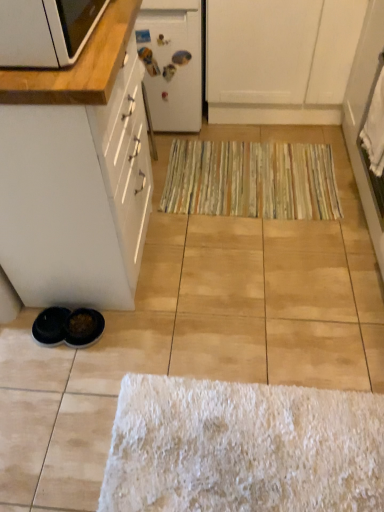
Question: Is white matte cabinet at lower left, the 1th cabinetry when ordered from front to back, not near white matte refrigerator at upper center?

Choices:
 (A) yes
 (B) no

Answer: (B)

Question: Considering the relative sizes of white matte cabinet at lower left, the second cabinetry from the back, and white matte refrigerator at upper center in the image provided, is white matte cabinet at lower left, the second cabinetry from the back, bigger than white matte refrigerator at upper center?

Choices:
 (A) no
 (B) yes

Answer: (B)

Question: Could you tell me if white matte cabinet at lower left, the second cabinetry from the back, is facing white matte refrigerator at upper center?

Choices:
 (A) yes
 (B) no

Answer: (B)

Question: Can we say white matte cabinet at lower left, placed as the 2th cabinetry when sorted from top to bottom, lies outside white matte refrigerator at upper center?

Choices:
 (A) no
 (B) yes

Answer: (B)

Question: Is white matte cabinet at lower left, which is the first cabinetry from bottom to top, surrounding white matte refrigerator at upper center?

Choices:
 (A) yes
 (B) no

Answer: (B)

Question: In terms of height, does matte wood countertop at upper left look taller or shorter compared to white matte cabinet at upper center, acting as the 2th cabinetry starting from the bottom?

Choices:
 (A) short
 (B) tall

Answer: (A)

Question: Is matte wood countertop at upper left in front of or behind white matte cabinet at upper center, arranged as the second cabinetry when viewed from the left, in the image?

Choices:
 (A) front
 (B) behind

Answer: (A)

Question: Is point (122, 26) positioned closer to the camera than point (339, 36)?

Choices:
 (A) closer
 (B) farther

Answer: (A)

Question: Looking at their shapes, would you say matte wood countertop at upper left is wider or thinner than white matte cabinet at upper center, acting as the 2th cabinetry starting from the bottom?

Choices:
 (A) thin
 (B) wide

Answer: (A)

Question: From their relative heights in the image, would you say white matte refrigerator at upper center is taller or shorter than white matte cabinet at lower left, the 1th cabinetry when ordered from front to back?

Choices:
 (A) tall
 (B) short

Answer: (B)

Question: From the image's perspective, is white matte refrigerator at upper center above or below white matte cabinet at lower left, the 1th cabinetry when ordered from front to back?

Choices:
 (A) below
 (B) above

Answer: (B)

Question: Is point tap(195, 15) closer or farther from the camera than point tap(1, 146)?

Choices:
 (A) closer
 (B) farther

Answer: (B)

Question: From a real-world perspective, relative to white matte cabinet at lower left, the 1th cabinetry when ordered from front to back, is white matte refrigerator at upper center vertically above or below?

Choices:
 (A) above
 (B) below

Answer: (B)

Question: From a real-world perspective, is matte wood countertop at upper left above or below white matte cabinet at lower left, which is counted as the 2th cabinetry, starting from the right?

Choices:
 (A) above
 (B) below

Answer: (A)

Question: Based on their sizes in the image, would you say matte wood countertop at upper left is bigger or smaller than white matte cabinet at lower left, which is counted as the 2th cabinetry, starting from the right?

Choices:
 (A) small
 (B) big

Answer: (A)